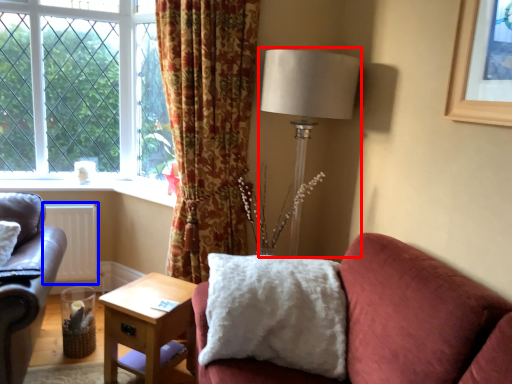
Question: Which of the following is the farthest to the observer, table lamp (highlighted by a red box) or radiator (highlighted by a blue box)?

Choices:
 (A) table lamp
 (B) radiator

Answer: (B)